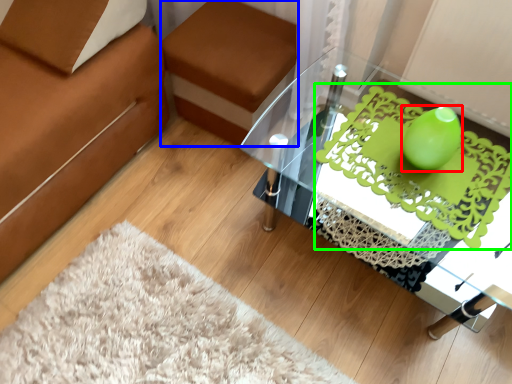
Question: Estimate the real-world distances between objects in this image. Which object is farther from teal (highlighted by a red box), footrest (highlighted by a blue box) or design (highlighted by a green box)?

Choices:
 (A) footrest
 (B) design

Answer: (A)